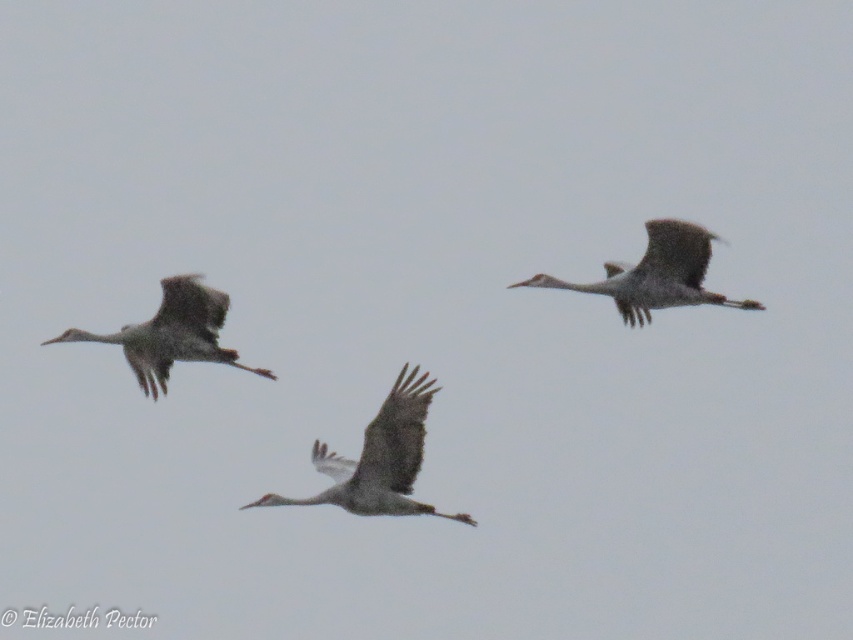
Question: Can you confirm if gray feathered crane at left is positioned to the right of gray feathered crane at upper right?

Choices:
 (A) yes
 (B) no

Answer: (B)

Question: Is gray feathered crane at left thinner than gray feathered crane at upper right?

Choices:
 (A) yes
 (B) no

Answer: (A)

Question: Which object appears farthest from the camera in this image?

Choices:
 (A) gray feathered crane at upper right
 (B) gray feathered crane at center

Answer: (B)

Question: Based on their relative distances, which object is farther from the gray feathered crane at center?

Choices:
 (A) gray feathered crane at left
 (B) gray feathered crane at upper right

Answer: (B)

Question: Can you confirm if gray feathered crane at center is smaller than gray feathered crane at upper right?

Choices:
 (A) no
 (B) yes

Answer: (A)

Question: Among these points, which one is nearest to the camera?

Choices:
 (A) (433, 506)
 (B) (201, 333)

Answer: (A)